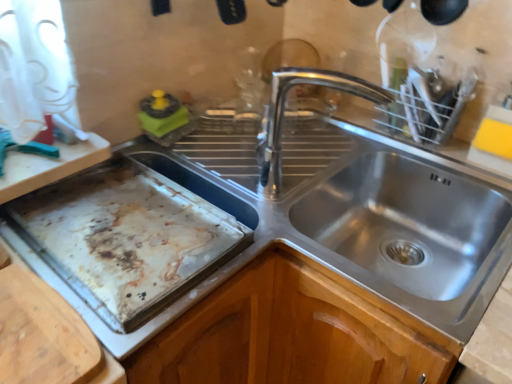
Question: Relative to polished metal tap at center, is stained aluminum baking sheet at left in front or behind?

Choices:
 (A) front
 (B) behind

Answer: (A)

Question: From a real-world perspective, relative to polished metal tap at center, is stained aluminum baking sheet at left vertically above or below?

Choices:
 (A) above
 (B) below

Answer: (B)

Question: Estimate the real-world distances between objects in this image. Which object is farther from the polished metal tap at center?

Choices:
 (A) stained aluminum baking sheet at left
 (B) stainless steel sink at center

Answer: (A)

Question: Estimate the real-world distances between objects in this image. Which object is closer to the stained aluminum baking sheet at left?

Choices:
 (A) polished metal tap at center
 (B) stainless steel sink at center

Answer: (A)